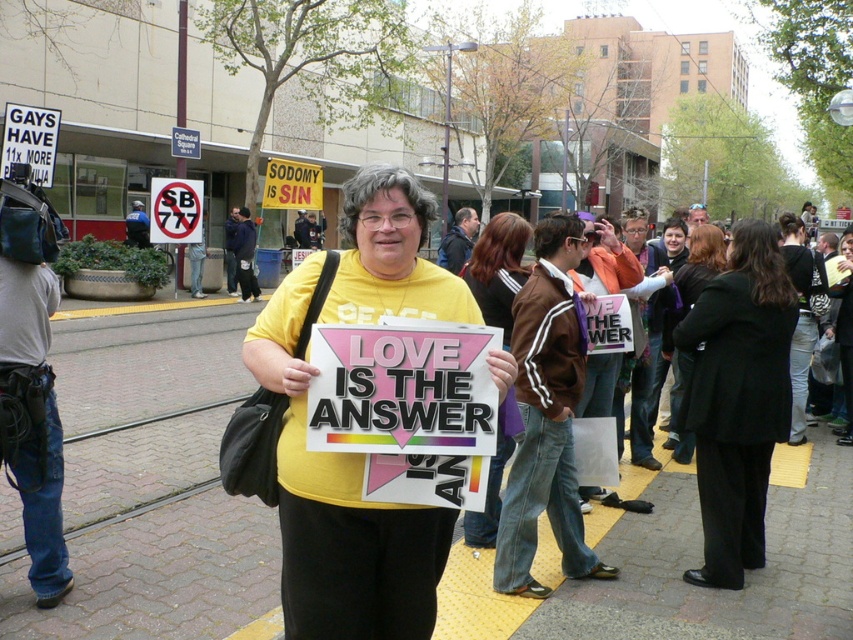
Who is higher up, black wool coat at center or matte yellow shirt at center?

matte yellow shirt at center is higher up.

Based on the photo, does black wool coat at center appear on the right side of matte yellow shirt at center?

Correct, you'll find black wool coat at center to the right of matte yellow shirt at center.

Is point (712, 364) positioned after point (498, 241)?

No, (712, 364) is in front of (498, 241).

Locate an element on the screen. Image resolution: width=853 pixels, height=640 pixels. black wool coat at center is located at coordinates pyautogui.click(x=737, y=397).

Who is more distant from viewer, (625, 580) or (700, 228)?

The point (700, 228) is behind.

Between brick pavement at center and black coat at center, which one has less height?

With less height is brick pavement at center.

Image resolution: width=853 pixels, height=640 pixels. Identify the location of brick pavement at center. (149, 490).

Is point (616, 515) behind point (727, 412)?

Yes, point (616, 515) is farther from viewer.

Locate an element on the screen. The width and height of the screenshot is (853, 640). brick pavement at center is located at coordinates (149, 490).

Where is `brick pavement at center`? brick pavement at center is located at coordinates (149, 490).